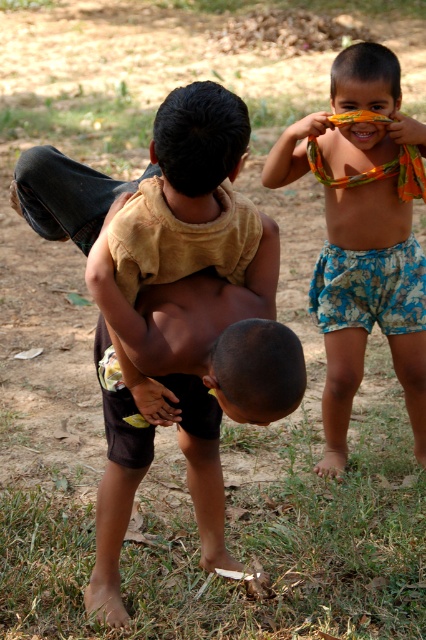
Which is above, brown cotton shirt at center or floral shorts at right?

floral shorts at right is above.

Is brown cotton shirt at center to the left of floral shorts at right from the viewer's perspective?

Correct, you'll find brown cotton shirt at center to the left of floral shorts at right.

Where is `brown cotton shirt at center`? brown cotton shirt at center is located at coordinates (199, 262).

Can you confirm if floral shorts at right is shorter than brown matte nose at center?

No, floral shorts at right is not shorter than brown matte nose at center.

Consider the image. Can you confirm if floral shorts at right is positioned above brown matte nose at center?

Yes, floral shorts at right is above brown matte nose at center.

This screenshot has height=640, width=426. What do you see at coordinates (362, 237) in the screenshot?
I see `floral shorts at right` at bounding box center [362, 237].

Find the location of a particular element. floral shorts at right is located at coordinates (362, 237).

Who is more distant from viewer, (221, 381) or (212, 380)?

Point (212, 380)

Between point (97, 547) and point (210, 384), which one is positioned in front?

Point (210, 384) is more forward.

Identify the location of brown cotton shirt at center. (199, 262).